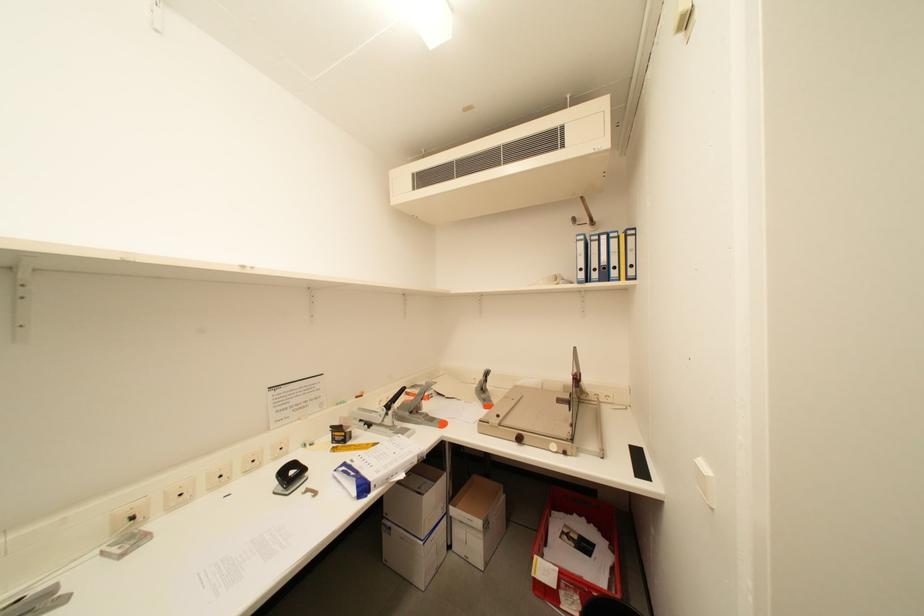
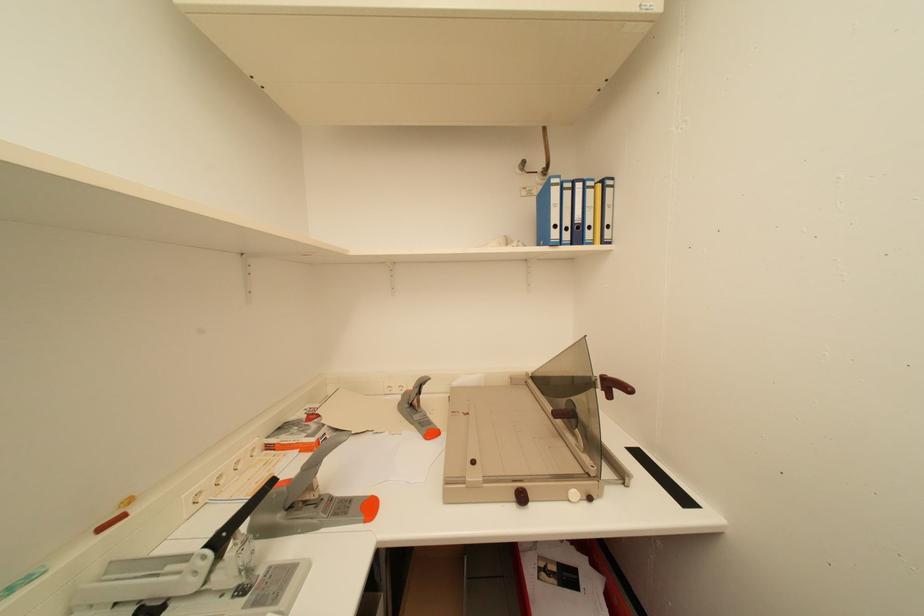
Question: What movement of the cameraman would produce the second image?

Choices:
 (A) Left
 (B) Right
 (C) Forward
 (D) Backward

Answer: (C)